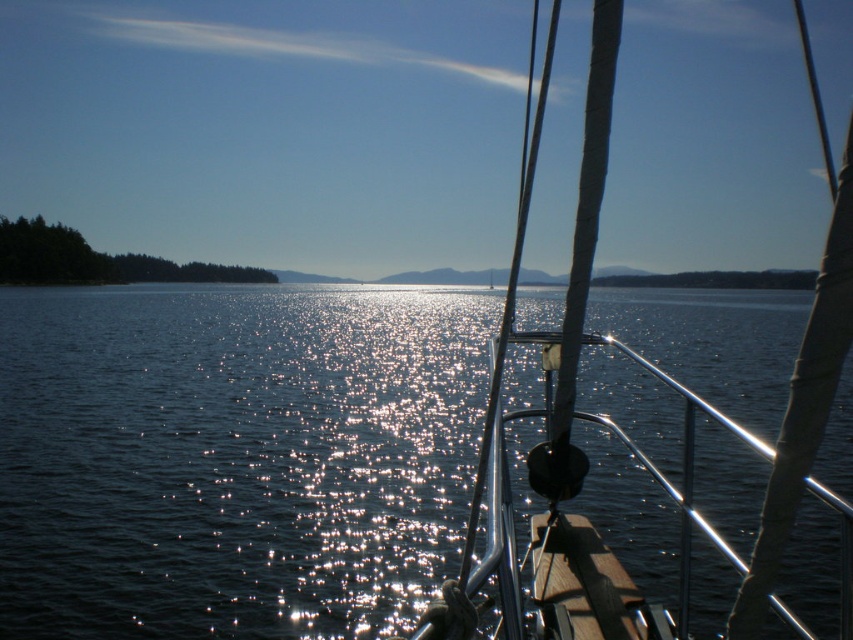
This screenshot has width=853, height=640. Describe the element at coordinates (233, 458) in the screenshot. I see `sparkling blue water at center` at that location.

Does sparkling blue water at center appear on the left side of white matte sailboat at center?

Yes, sparkling blue water at center is to the left of white matte sailboat at center.

In order to click on sparkling blue water at center in this screenshot , I will do 233,458.